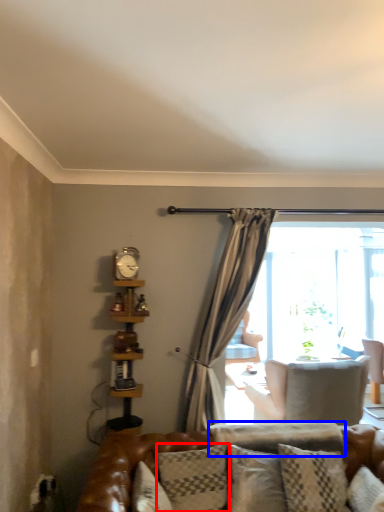
Question: Which object appears closest to the camera in this image, pillow (highlighted by a red box) or pillow (highlighted by a blue box)?

Choices:
 (A) pillow
 (B) pillow

Answer: (A)